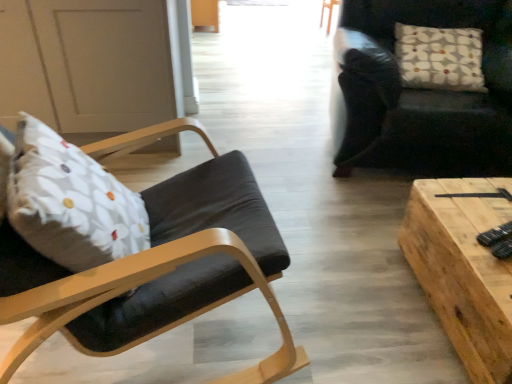
Question: Is wooden plank table at center to the right of dark leather chair at upper right, the second chair positioned from the front, from the viewer's perspective?

Choices:
 (A) yes
 (B) no

Answer: (B)

Question: Would you say wooden plank table at center contains dark leather chair at upper right, which ranks as the second chair in left-to-right order?

Choices:
 (A) no
 (B) yes

Answer: (A)

Question: Is wooden plank table at center looking in the opposite direction of dark leather chair at upper right, the second chair positioned from the front?

Choices:
 (A) yes
 (B) no

Answer: (B)

Question: From the image's perspective, is wooden plank table at center located above dark leather chair at upper right, the second chair positioned from the front?

Choices:
 (A) yes
 (B) no

Answer: (B)

Question: Considering the relative sizes of wooden plank table at center and dark leather chair at upper right, the second chair positioned from the front, in the image provided, is wooden plank table at center smaller than dark leather chair at upper right, the second chair positioned from the front,?

Choices:
 (A) no
 (B) yes

Answer: (B)

Question: Is wooden plank table at center taller than dark leather chair at upper right, which ranks as the second chair in left-to-right order?

Choices:
 (A) no
 (B) yes

Answer: (A)

Question: Is matte black chair at left, the 1th chair in the front-to-back sequence, further to the viewer compared to white floral fabric pillow at upper right?

Choices:
 (A) no
 (B) yes

Answer: (A)

Question: Does matte black chair at left, the 1th chair in the front-to-back sequence, have a greater height compared to white floral fabric pillow at upper right?

Choices:
 (A) yes
 (B) no

Answer: (A)

Question: Is white floral fabric pillow at upper right a part of matte black chair at left, the 2th chair when ordered from back to front?

Choices:
 (A) yes
 (B) no

Answer: (B)

Question: Are matte black chair at left, the 2th chair when ordered from back to front, and white floral fabric pillow at upper right beside each other?

Choices:
 (A) no
 (B) yes

Answer: (A)

Question: Is matte black chair at left, the 2th chair when ordered from back to front, thinner than white floral fabric pillow at upper right?

Choices:
 (A) no
 (B) yes

Answer: (A)

Question: Does matte black chair at left, the 2th chair when ordered from back to front, have a greater width compared to white floral fabric pillow at upper right?

Choices:
 (A) yes
 (B) no

Answer: (A)

Question: Is matte black chair at left, the 2th chair when ordered from back to front, looking in the opposite direction of dark leather chair at upper right, which ranks as the second chair in left-to-right order?

Choices:
 (A) yes
 (B) no

Answer: (B)